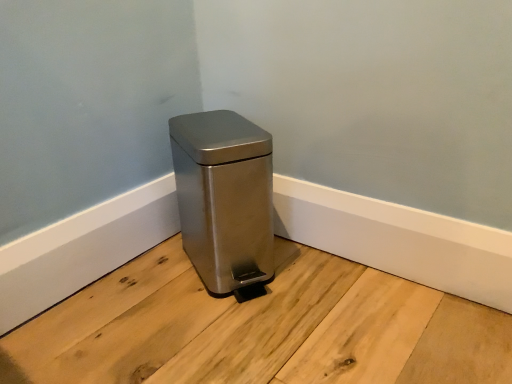
At what (x,y) coordinates should I click in order to perform the action: click on brushed metal trash can at center. Please return your answer as a coordinate pair (x, y). This screenshot has height=384, width=512. Looking at the image, I should click on (225, 200).

What do you see at coordinates (225, 200) in the screenshot?
I see `brushed metal trash can at center` at bounding box center [225, 200].

At what (x,y) coordinates should I click in order to perform the action: click on brushed metal trash can at center. Please return your answer as a coordinate pair (x, y). Looking at the image, I should click on (225, 200).